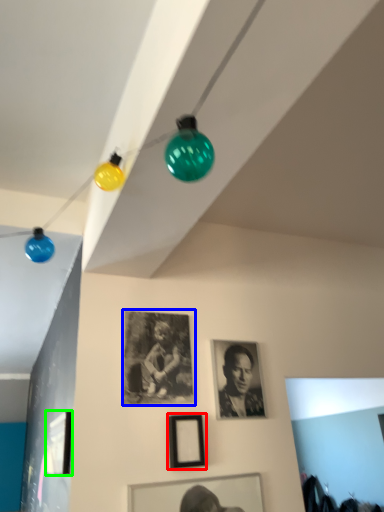
Question: Which object is positioned closest to picture frame (highlighted by a red box)? Select from picture frame (highlighted by a blue box) and picture frame (highlighted by a green box).

Choices:
 (A) picture frame
 (B) picture frame

Answer: (A)